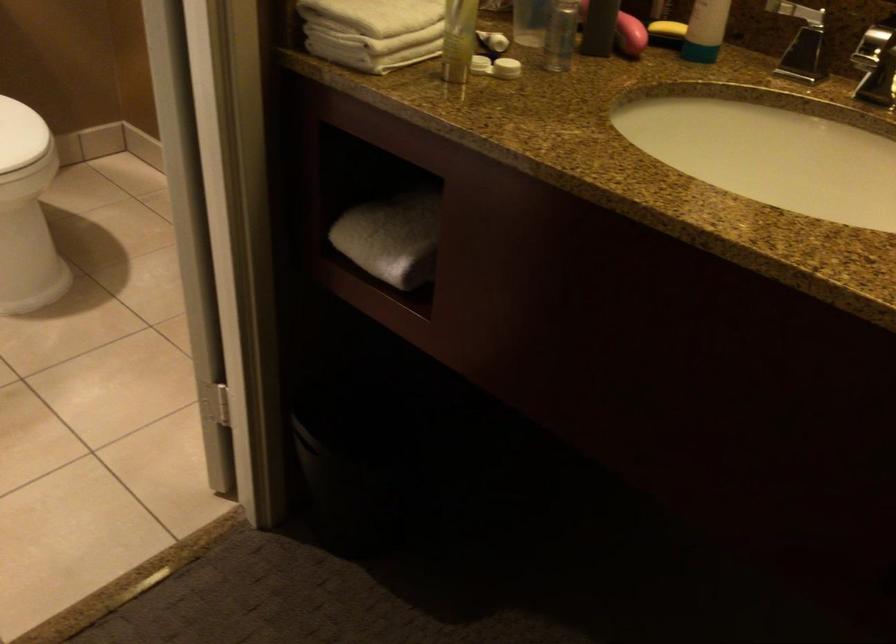
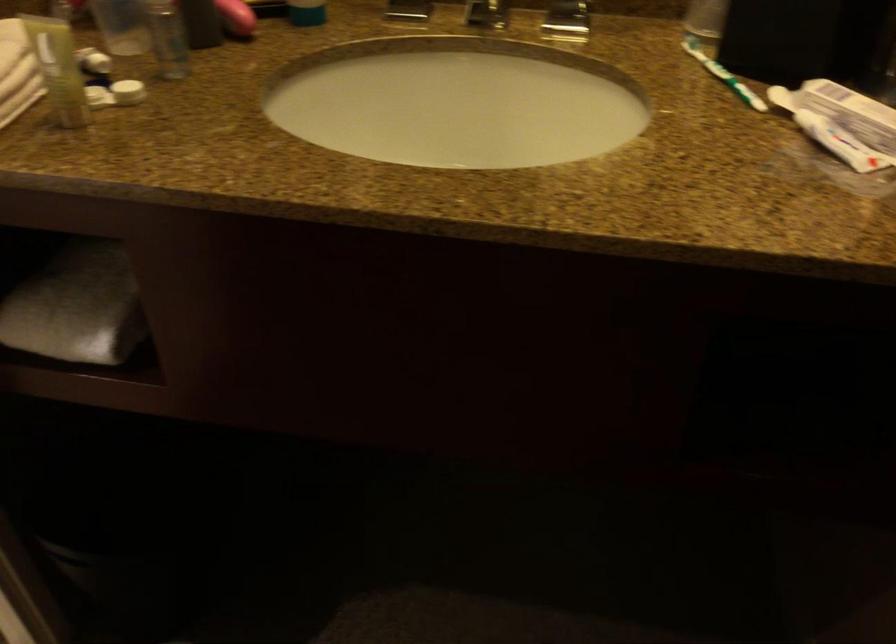
Locate, in the second image, the point that corresponds to [395,234] in the first image.

(76, 306)